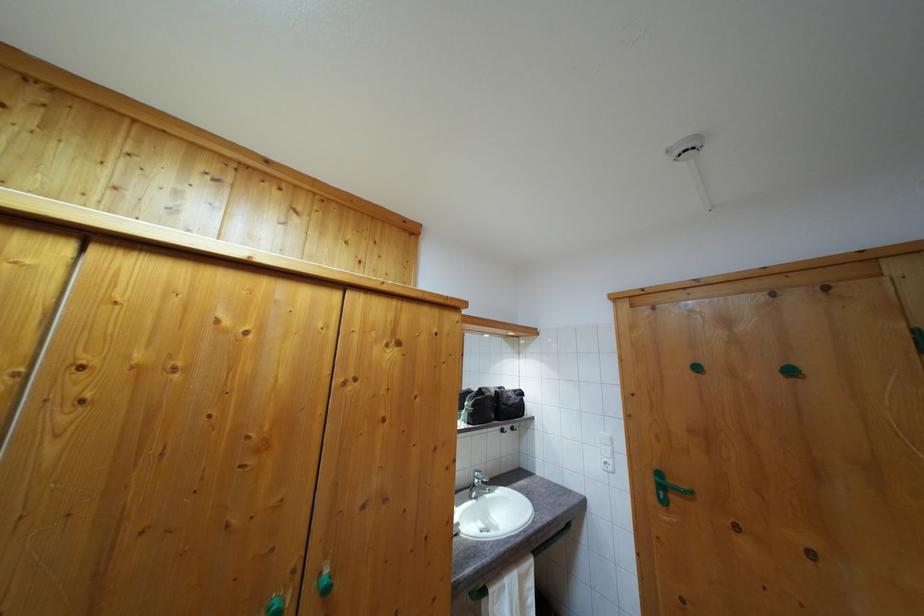
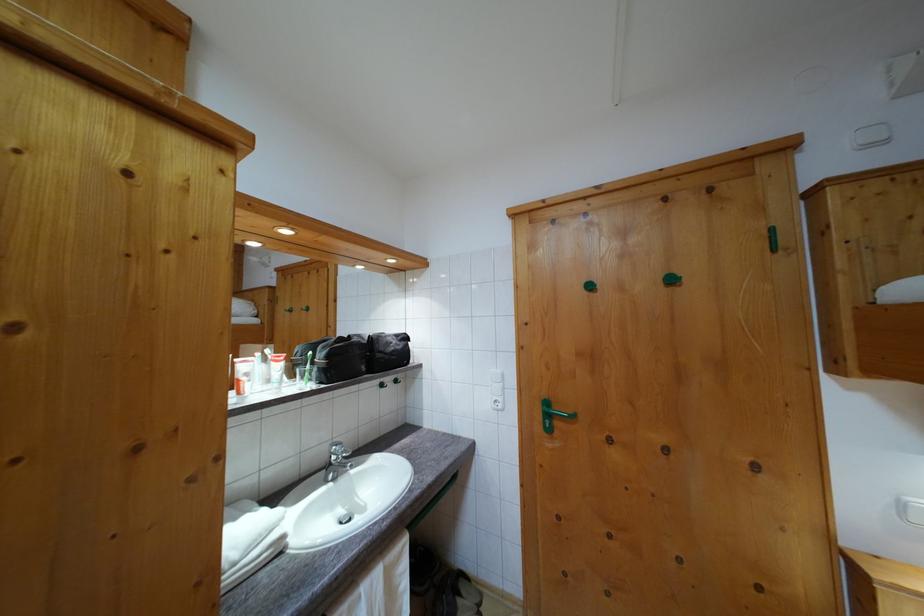
Where in the second image is the point corresponding to (x=518, y=398) from the first image?

(400, 342)